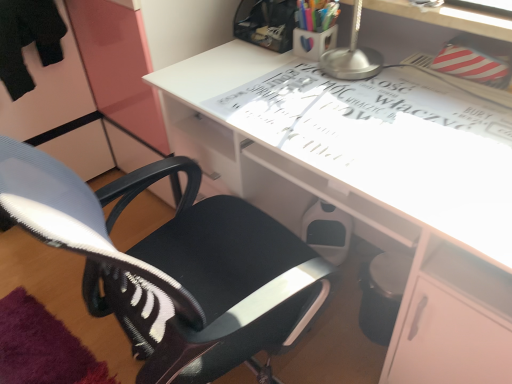
You are a GUI agent. You are given a task and a screenshot of the screen. Output one action in this format:
    pyautogui.click(x=<x>, y=<y>)
    Task: Click on the free space in front of matte plastic cup at upper center, the first stationery in the bottom-to-top sequence
    The height and width of the screenshot is (384, 512).
    Given the screenshot: What is the action you would take?
    pyautogui.click(x=318, y=82)